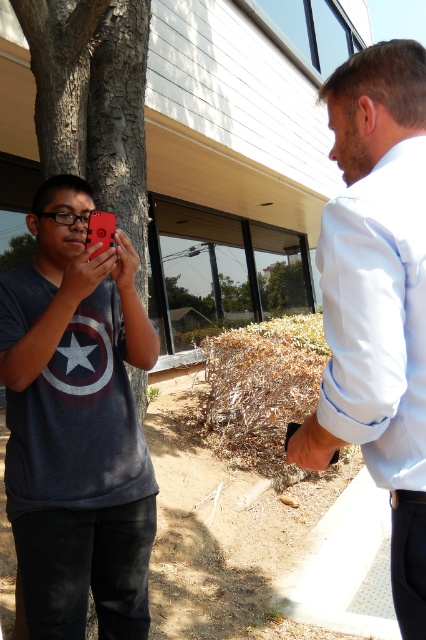
Question: Can you confirm if matte black phone at left is positioned below white shirt at upper right?

Choices:
 (A) no
 (B) yes

Answer: (B)

Question: Does white shirt at upper right appear under green leafy tree at left?

Choices:
 (A) yes
 (B) no

Answer: (A)

Question: Considering the real-world distances, which object is closest to the smooth bark tree at left?

Choices:
 (A) white shirt at upper right
 (B) matte black phone at left
 (C) green leafy tree at left

Answer: (B)

Question: Which of the following is the farthest from the observer?

Choices:
 (A) smooth bark tree at left
 (B) matte black phone at left
 (C) white shirt at upper right

Answer: (A)

Question: From the image, what is the correct spatial relationship of white shirt at upper right in relation to smooth bark tree at left?

Choices:
 (A) left
 (B) right

Answer: (B)

Question: Among these objects, which one is farthest from the camera?

Choices:
 (A) matte black phone at left
 (B) green leafy tree at left
 (C) white shirt at upper right
 (D) smooth bark tree at left

Answer: (B)